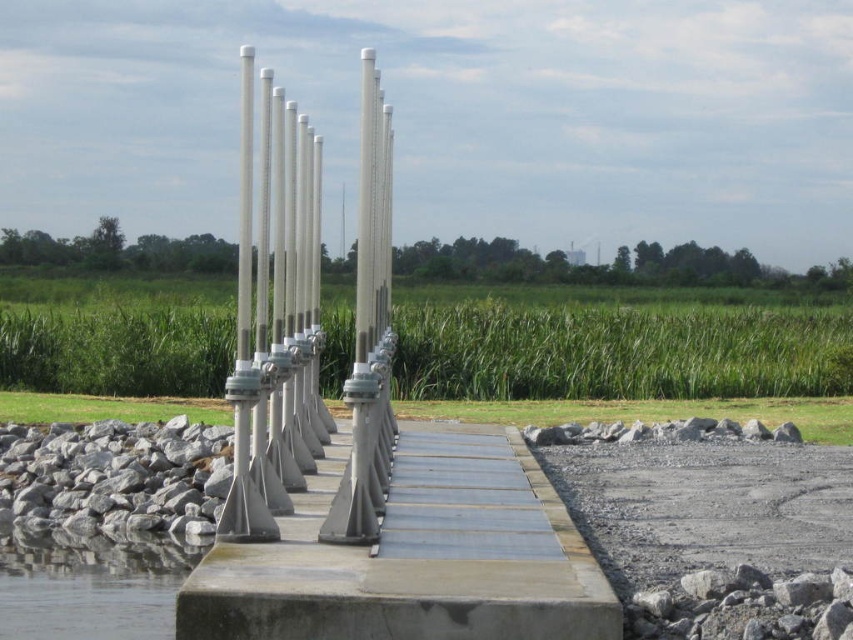
Can you confirm if smooth concrete dock at center is bigger than metallic gray boardwalk at center?

Yes, smooth concrete dock at center is bigger than metallic gray boardwalk at center.

Identify the location of smooth concrete dock at center. The image size is (853, 640). (415, 556).

I want to click on smooth concrete dock at center, so click(x=415, y=556).

Does metallic gray boardwalk at center have a larger size compared to clear water at lower left?

No.

Does metallic gray boardwalk at center appear on the left side of clear water at lower left?

Incorrect, metallic gray boardwalk at center is not on the left side of clear water at lower left.

Describe the element at coordinates (462, 500) in the screenshot. I see `metallic gray boardwalk at center` at that location.

I want to click on metallic gray boardwalk at center, so tap(462, 500).

Where is `white metallic pole at center`? Image resolution: width=853 pixels, height=640 pixels. white metallic pole at center is located at coordinates (276, 323).

Which is more to the left, white metallic pole at center or metallic gray boardwalk at center?

Positioned to the left is white metallic pole at center.

Is point (393, 344) more distant than point (503, 440)?

No.

Locate an element on the screen. white metallic pole at center is located at coordinates 276,323.